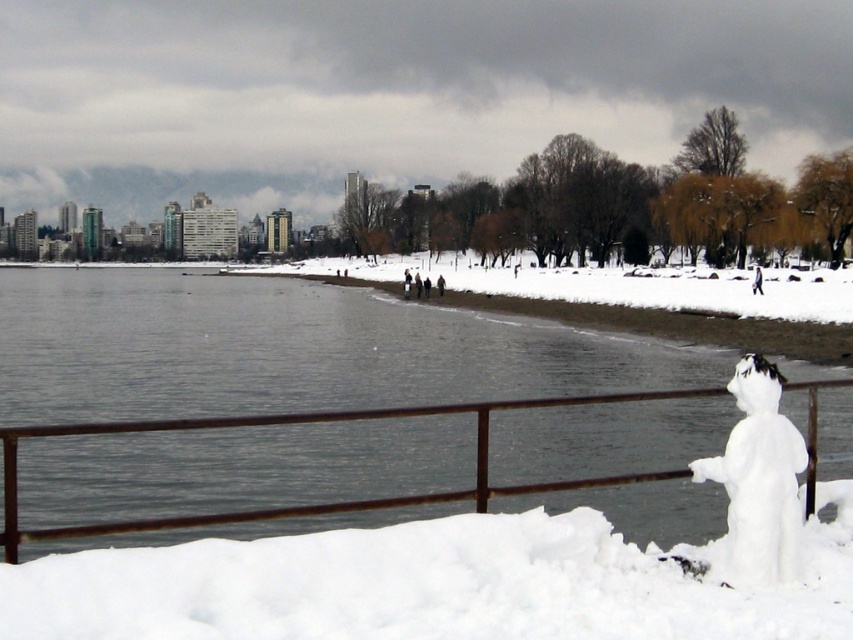
Question: Does rusty metal fence at lower center have a lesser width compared to white fluffy snowman at lower right?

Choices:
 (A) no
 (B) yes

Answer: (A)

Question: Observing the image, what is the correct spatial positioning of rusty metal fence at lower center in reference to white fluffy snowman at lower right?

Choices:
 (A) right
 (B) left

Answer: (A)

Question: Is rusty metal fence at lower center bigger than white fluffy snowman at lower right?

Choices:
 (A) no
 (B) yes

Answer: (B)